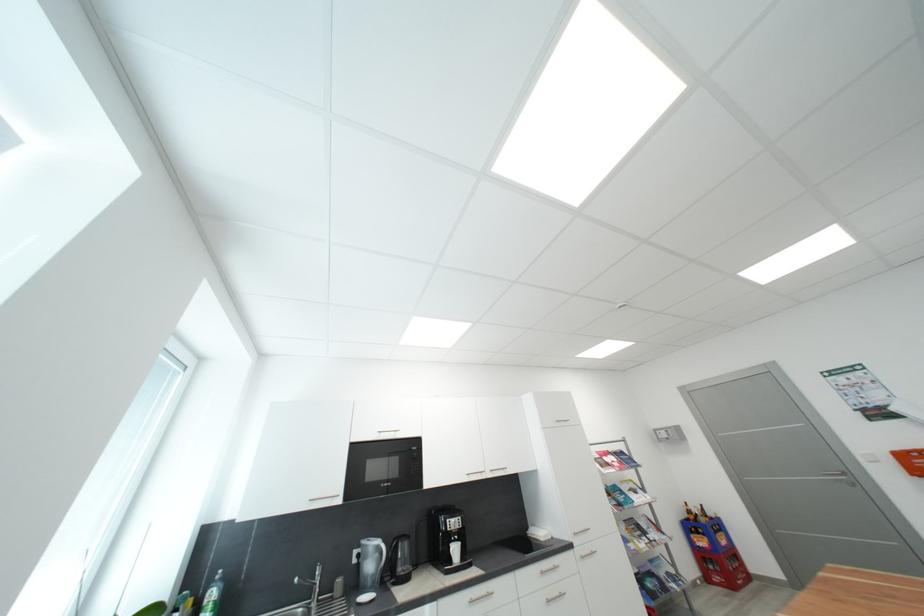
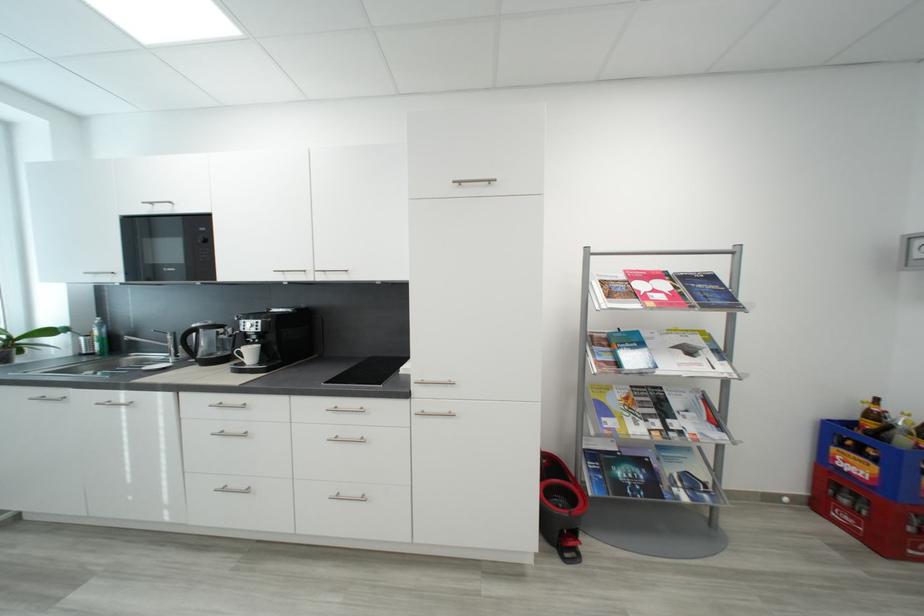
In the second image, find the point that corresponds to the point at 463,552 in the first image.

(257, 354)